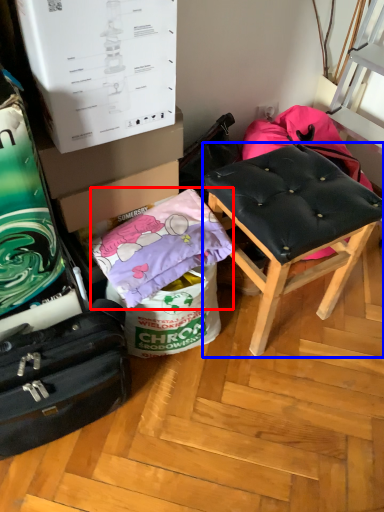
Question: Among these objects, which one is nearest to the camera, material (highlighted by a red box) or stool (highlighted by a blue box)?

Choices:
 (A) material
 (B) stool

Answer: (B)